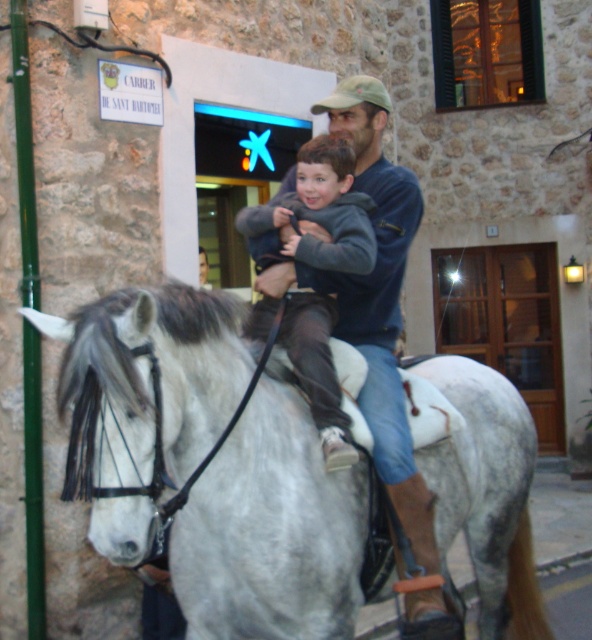
Is gray matte/suede horse at center positioned at the back of gray fleece jacket at center?

No, it is not.

This screenshot has height=640, width=592. Find the location of `gray matte/suede horse at center`. gray matte/suede horse at center is located at coordinates (271, 531).

Who is more forward, (304, 417) or (349, 236)?

Point (304, 417)

Identify the location of gray matte/suede horse at center. The height and width of the screenshot is (640, 592). (271, 531).

Is blue denim jacket at center bigger than gray fleece jacket at center?

Yes.

Is the position of blue denim jacket at center less distant than that of gray fleece jacket at center?

No, blue denim jacket at center is further to the viewer.

Locate an element on the screen. blue denim jacket at center is located at coordinates (382, 300).

You are a GUI agent. You are given a task and a screenshot of the screen. Output one action in this format:
    pyautogui.click(x=<x>, y=<y>)
    Task: Click on the blue denim jacket at center
    
    Given the screenshot: What is the action you would take?
    pyautogui.click(x=382, y=300)

Does gray matte/suede horse at center have a greater height compared to blue denim jacket at center?

No.

Which is in front, point (239, 392) or point (382, 212)?

Point (239, 392) is in front.

I want to click on gray matte/suede horse at center, so click(271, 531).